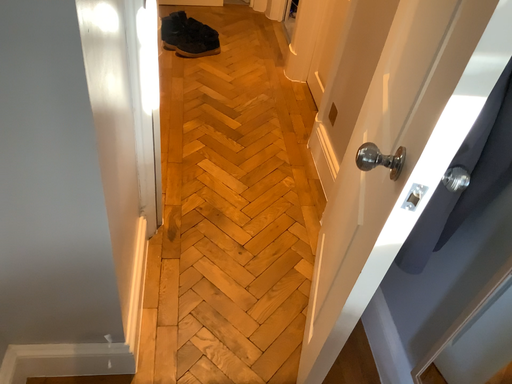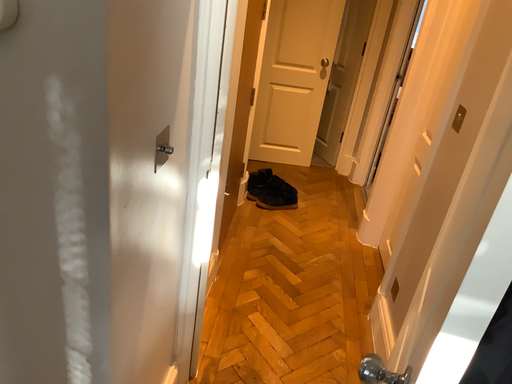
Question: How did the camera likely rotate when shooting the video?

Choices:
 (A) rotated downward
 (B) rotated upward

Answer: (B)